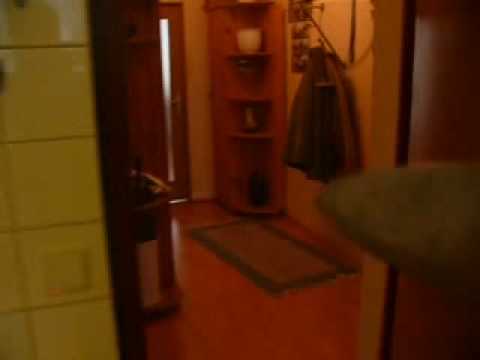
I want to click on rug, so click(x=242, y=273).